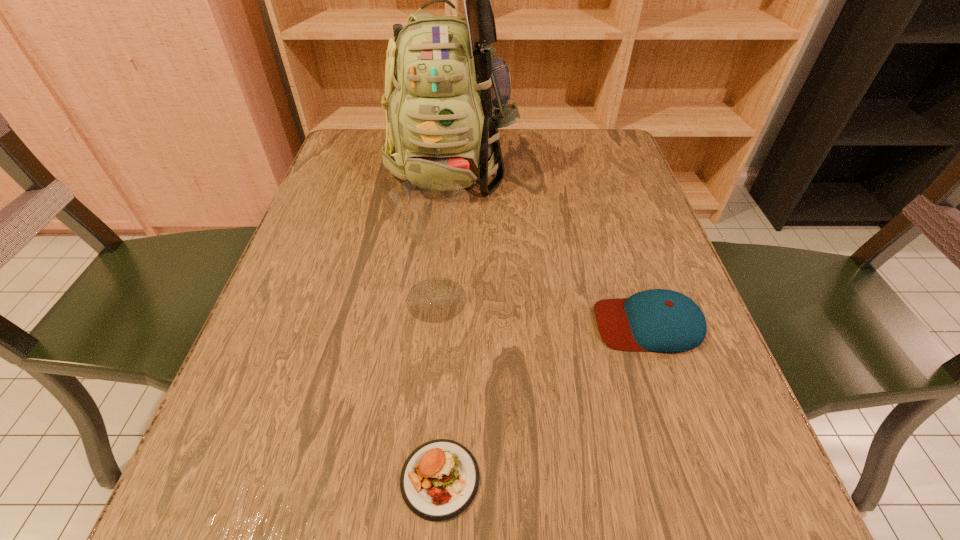
Locate an element on the screen. The image size is (960, 540). blank region between the patty (food) and the rightmost object is located at coordinates (544, 401).

Locate an element on the screen. free space between the third tallest object and the farthest object is located at coordinates (550, 244).

Where is `free space that is in between the third shortest object and the patty (food)`? free space that is in between the third shortest object and the patty (food) is located at coordinates (438, 389).

Identify which object is located as the nearest to the baseball cap. Please provide its 2D coordinates. Your answer should be formatted as a tuple, i.e. [(x, y)], where the tuple contains the x and y coordinates of a point satisfying the conditions above.

[(427, 210)]

Point out which object is positioned as the second nearest to the tallest object. Please provide its 2D coordinates. Your answer should be formatted as a tuple, i.e. [(x, y)], where the tuple contains the x and y coordinates of a point satisfying the conditions above.

[(658, 320)]

Where is `free location that satisfies the following two spatial constraints: 1. on the front-facing side of the backpack; 2. on the right side of the nearest object`? The width and height of the screenshot is (960, 540). free location that satisfies the following two spatial constraints: 1. on the front-facing side of the backpack; 2. on the right side of the nearest object is located at coordinates (426, 478).

Find the location of a particular element. free location that satisfies the following two spatial constraints: 1. on the front-facing side of the tallest object; 2. on the left side of the shortest object is located at coordinates (426, 478).